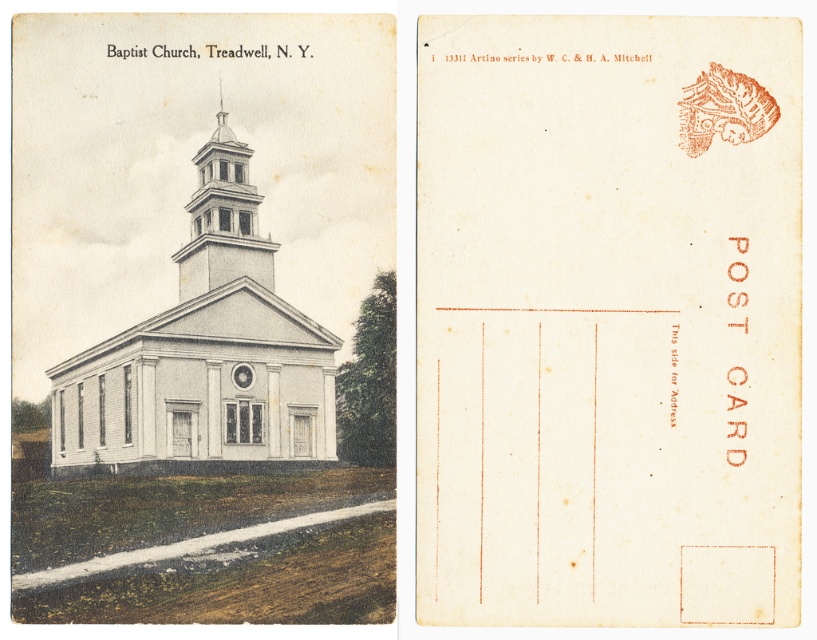
Consider the image. Does white wood church at center appear on the left side of white wood tower at center?

Correct, you'll find white wood church at center to the left of white wood tower at center.

Can you confirm if white wood church at center is smaller than white wood tower at center?

No.

This screenshot has height=640, width=817. What do you see at coordinates (204, 355) in the screenshot?
I see `white wood church at center` at bounding box center [204, 355].

Locate an element on the screen. Image resolution: width=817 pixels, height=640 pixels. white wood church at center is located at coordinates (204, 355).

Does white paper at center have a lesser height compared to white wood church at center?

Correct, white paper at center is not as tall as white wood church at center.

Who is more forward, (x=521, y=515) or (x=208, y=376)?

Point (x=521, y=515) is more forward.

You are a GUI agent. You are given a task and a screenshot of the screen. Output one action in this format:
    pyautogui.click(x=<x>, y=<y>)
    Task: Click on the white paper at center
    
    Given the screenshot: What is the action you would take?
    pyautogui.click(x=608, y=321)

Who is more distant from viewer, (588, 289) or (230, 228)?

The point (230, 228) is behind.

Is point (481, 529) positioned after point (188, 288)?

That is False.

At what (x,y) coordinates should I click in order to perform the action: click on white paper at center. Please return your answer as a coordinate pair (x, y). Looking at the image, I should click on (608, 321).